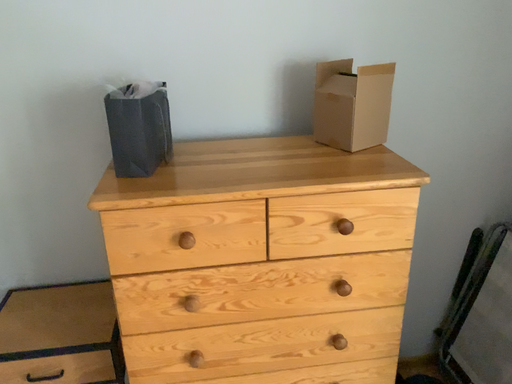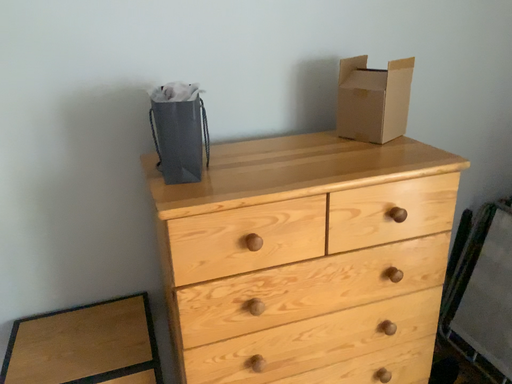
Question: How did the camera likely rotate when shooting the video?

Choices:
 (A) rotated right
 (B) rotated left

Answer: (A)